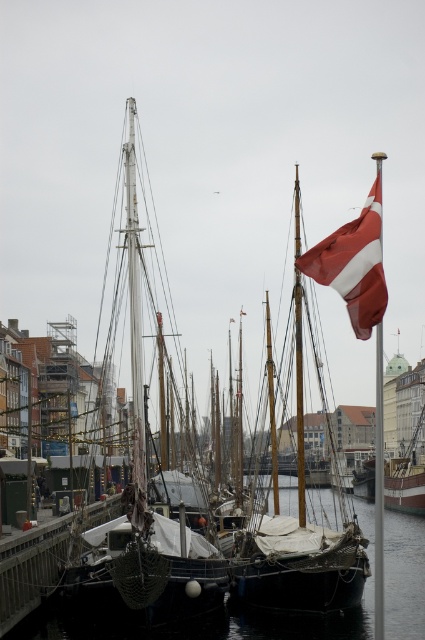
Question: Is white matte sailboat at left above transparent water at lower left?

Choices:
 (A) yes
 (B) no

Answer: (A)

Question: Is red fabric flag at upper right above wooden mast at center?

Choices:
 (A) no
 (B) yes

Answer: (B)

Question: Which of these objects is positioned closest to the red and white fabric sailboat at center?

Choices:
 (A) transparent water at lower left
 (B) white matte sailboat at left
 (C) red fabric flag at upper right

Answer: (B)

Question: Does white matte sailboat at left appear under transparent water at lower left?

Choices:
 (A) yes
 (B) no

Answer: (B)

Question: Which of the following is the farthest from the observer?

Choices:
 (A) transparent water at lower left
 (B) wooden mast at center

Answer: (A)

Question: Which object is farther from the camera taking this photo?

Choices:
 (A) wooden mast at center
 (B) transparent water at lower left
 (C) white matte sailboat at left

Answer: (B)